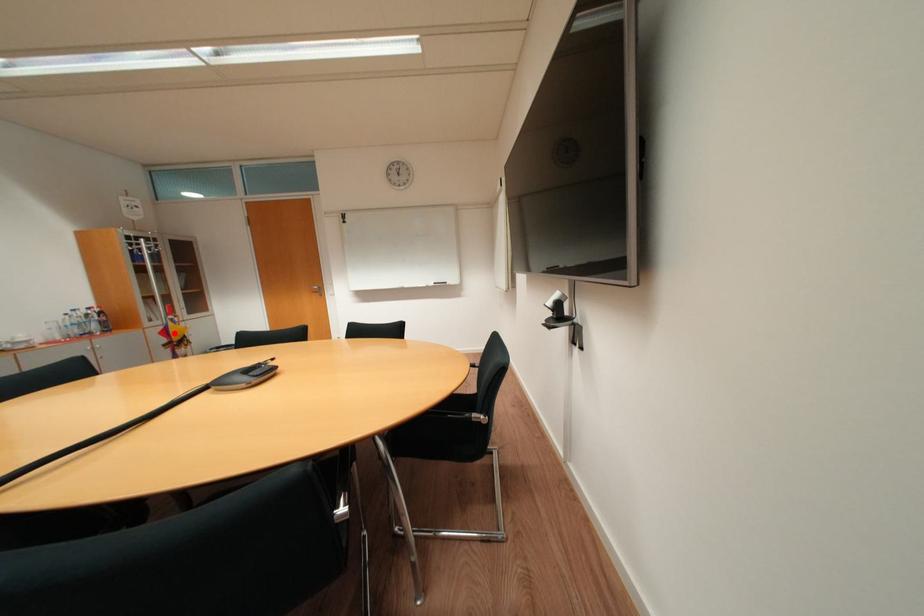
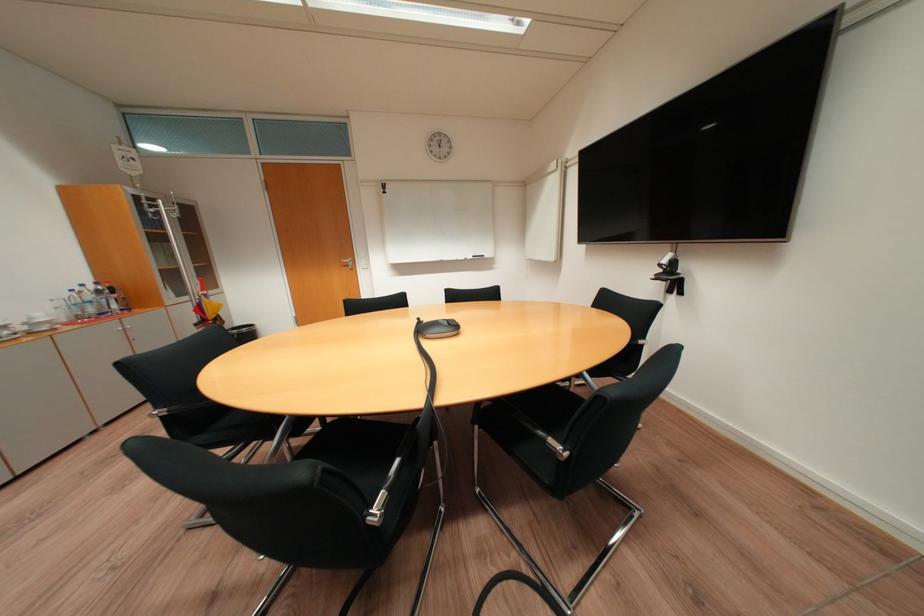
Question: A red point is marked in image1. In image2, is the corresponding 3D point closer to the camera or farther? Reply with the corresponding letter.

Choices:
 (A) The corresponding 3D point is closer.
 (B) The corresponding 3D point is farther.

Answer: (B)